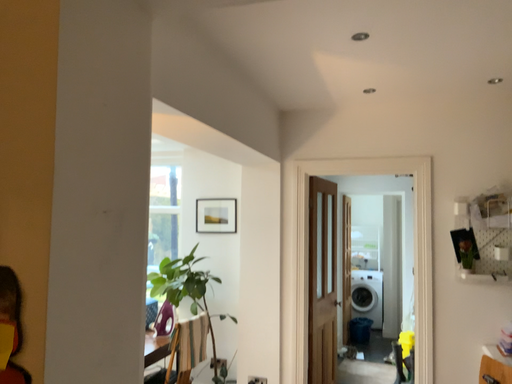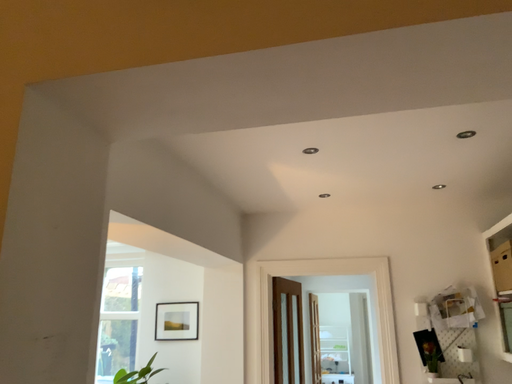
Question: How did the camera likely rotate when shooting the video?

Choices:
 (A) rotated downward
 (B) rotated upward

Answer: (B)